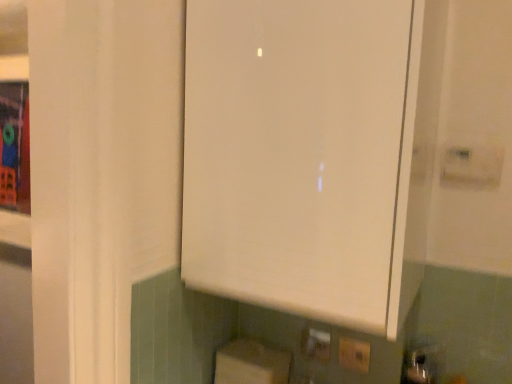
Locate an element on the screen. white cardboard box at lower center is located at coordinates (251, 363).

How much space does white plastic electric outlet at lower center, which is counted as the 1th electric outlet, starting from the right, occupy horizontally?

The width of white plastic electric outlet at lower center, which is counted as the 1th electric outlet, starting from the right, is 0.60 inches.

I want to click on white matte cabinet at center, so click(x=303, y=156).

At what (x,y) coordinates should I click in order to perform the action: click on white cardboard box at lower center. Please return your answer as a coordinate pair (x, y). Looking at the image, I should click on (251, 363).

From the picture: What's the angular difference between yellow plastic electric outlet at lower center, which is the 2th electric outlet from right to left, and white plastic electric outlet at lower center, which appears as the 2th electric outlet when viewed from the back,'s facing directions?

3.33 degrees.

Is yellow plastic electric outlet at lower center, which appears as the first electric outlet when viewed from the back, to the left of white plastic electric outlet at lower center, which is the 2th electric outlet in left-to-right order, from the viewer's perspective?

Indeed, yellow plastic electric outlet at lower center, which appears as the first electric outlet when viewed from the back, is positioned on the left side of white plastic electric outlet at lower center, which is the 2th electric outlet in left-to-right order.

Would you consider yellow plastic electric outlet at lower center, placed as the first electric outlet when sorted from left to right, to be distant from white plastic electric outlet at lower center, which is the 2th electric outlet in left-to-right order?

yellow plastic electric outlet at lower center, placed as the first electric outlet when sorted from left to right, is actually quite close to white plastic electric outlet at lower center, which is the 2th electric outlet in left-to-right order.

From a real-world perspective, is yellow plastic electric outlet at lower center, which appears as the first electric outlet when viewed from the back, beneath white plastic electric outlet at lower center, marked as the 1th electric outlet in a front-to-back arrangement?

Yes.

Considering the points (407, 232) and (273, 354), which point is behind, point (407, 232) or point (273, 354)?

Positioned behind is point (273, 354).

Identify the location of cabinetry in front of the white cardboard box at lower center. (303, 156).

How different are the orientations of white matte cabinet at center and white cardboard box at lower center in degrees?

There is a 1.71-degree angle between the facing directions of white matte cabinet at center and white cardboard box at lower center.

From the image's perspective, which is below, white matte cabinet at center or white cardboard box at lower center?

white cardboard box at lower center is shown below in the image.

From a real-world perspective, is white matte cabinet at center beneath white plastic electric outlet at lower center, which is the 2th electric outlet in left-to-right order?

Actually, white matte cabinet at center is physically above white plastic electric outlet at lower center, which is the 2th electric outlet in left-to-right order, in the real world.

Between white matte cabinet at center and white plastic electric outlet at lower center, which is the 2th electric outlet in left-to-right order, which one has larger width?

With larger width is white matte cabinet at center.

In the scene shown: Which point is more distant from viewer, (369, 116) or (367, 370)?

The point (367, 370) is behind.

Is white matte cabinet at center to the left or to the right of white plastic electric outlet at lower center, which is counted as the 1th electric outlet, starting from the right, in the image?

white matte cabinet at center is positioned on white plastic electric outlet at lower center, which is counted as the 1th electric outlet, starting from the right,'s left side.

Is white matte cabinet at center thinner than yellow plastic electric outlet at lower center, placed as the second electric outlet when sorted from front to back?

No.

Is the depth of white matte cabinet at center less than that of yellow plastic electric outlet at lower center, which is the 2th electric outlet from right to left?

Yes, it is in front of yellow plastic electric outlet at lower center, which is the 2th electric outlet from right to left.

Considering the sizes of objects white matte cabinet at center and yellow plastic electric outlet at lower center, which is the 2th electric outlet from right to left, in the image provided, who is shorter, white matte cabinet at center or yellow plastic electric outlet at lower center, which is the 2th electric outlet from right to left,?

yellow plastic electric outlet at lower center, which is the 2th electric outlet from right to left.

What's the angular difference between white cardboard box at lower center and white plastic electric outlet at lower center, which is the 2th electric outlet in left-to-right order,'s facing directions?

The angle between the facing direction of white cardboard box at lower center and the facing direction of white plastic electric outlet at lower center, which is the 2th electric outlet in left-to-right order, is 0.352 degrees.

Who is taller, white cardboard box at lower center or white plastic electric outlet at lower center, which is counted as the 1th electric outlet, starting from the right?

With more height is white cardboard box at lower center.

Are white cardboard box at lower center and white plastic electric outlet at lower center, which appears as the 2th electric outlet when viewed from the back, beside each other?

No, white cardboard box at lower center is not making contact with white plastic electric outlet at lower center, which appears as the 2th electric outlet when viewed from the back.

How much distance is there between white cardboard box at lower center and white plastic electric outlet at lower center, marked as the 1th electric outlet in a front-to-back arrangement?

white cardboard box at lower center is 9.51 inches from white plastic electric outlet at lower center, marked as the 1th electric outlet in a front-to-back arrangement.

Based on the photo, from the image's perspective, who appears lower, yellow plastic electric outlet at lower center, placed as the second electric outlet when sorted from front to back, or white cardboard box at lower center?

white cardboard box at lower center, from the image's perspective.

From a real-world perspective, does yellow plastic electric outlet at lower center, placed as the second electric outlet when sorted from front to back, stand above white cardboard box at lower center?

Yes, from a real-world perspective, yellow plastic electric outlet at lower center, placed as the second electric outlet when sorted from front to back, is over white cardboard box at lower center

This screenshot has height=384, width=512. Identify the location of cardboard box that appears below the yellow plastic electric outlet at lower center, placed as the second electric outlet when sorted from front to back (from the image's perspective). (251, 363).

Is yellow plastic electric outlet at lower center, which appears as the first electric outlet when viewed from the back, looking in the opposite direction of white cardboard box at lower center?

That's not correct — yellow plastic electric outlet at lower center, which appears as the first electric outlet when viewed from the back, is not looking away from white cardboard box at lower center.

Is yellow plastic electric outlet at lower center, which appears as the first electric outlet when viewed from the back, not within white matte cabinet at center?

That's correct, yellow plastic electric outlet at lower center, which appears as the first electric outlet when viewed from the back, is outside of white matte cabinet at center.

This screenshot has height=384, width=512. In order to click on cabinetry in front of the yellow plastic electric outlet at lower center, placed as the second electric outlet when sorted from front to back in this screenshot , I will do `click(303, 156)`.

Is yellow plastic electric outlet at lower center, which appears as the first electric outlet when viewed from the back, touching white matte cabinet at center?

No, yellow plastic electric outlet at lower center, which appears as the first electric outlet when viewed from the back, is not beside white matte cabinet at center.

Could you tell me if yellow plastic electric outlet at lower center, which is the 2th electric outlet from right to left, is turned towards white matte cabinet at center?

No, yellow plastic electric outlet at lower center, which is the 2th electric outlet from right to left, is not turned towards white matte cabinet at center.

Identify the location of electric outlet above the yellow plastic electric outlet at lower center, which appears as the first electric outlet when viewed from the back (from a real-world perspective). tap(354, 354).

Where is `cabinetry on the right of white cardboard box at lower center`? cabinetry on the right of white cardboard box at lower center is located at coordinates (303, 156).

Estimate the real-world distances between objects in this image. Which object is closer to white matte cabinet at center, yellow plastic electric outlet at lower center, which is the 2th electric outlet from right to left, or white plastic electric outlet at lower center, which is the 2th electric outlet in left-to-right order?

yellow plastic electric outlet at lower center, which is the 2th electric outlet from right to left, lies closer to white matte cabinet at center than the other object.

Considering their positions, is white matte cabinet at center positioned closer to white cardboard box at lower center than yellow plastic electric outlet at lower center, placed as the first electric outlet when sorted from left to right?

yellow plastic electric outlet at lower center, placed as the first electric outlet when sorted from left to right, lies closer to white cardboard box at lower center than the other object.

Looking at this image, considering their positions, is yellow plastic electric outlet at lower center, which appears as the first electric outlet when viewed from the back, positioned further to white plastic electric outlet at lower center, which is the 2th electric outlet in left-to-right order, than white cardboard box at lower center?

white cardboard box at lower center is further to white plastic electric outlet at lower center, which is the 2th electric outlet in left-to-right order.

Looking at the image, which one is located closer to white cardboard box at lower center, yellow plastic electric outlet at lower center, which is the 2th electric outlet from right to left, or white matte cabinet at center?

yellow plastic electric outlet at lower center, which is the 2th electric outlet from right to left, is closer to white cardboard box at lower center.

Considering their positions, is white cardboard box at lower center positioned further to white plastic electric outlet at lower center, which appears as the 2th electric outlet when viewed from the back, than yellow plastic electric outlet at lower center, placed as the second electric outlet when sorted from front to back?

white cardboard box at lower center lies further to white plastic electric outlet at lower center, which appears as the 2th electric outlet when viewed from the back, than the other object.

Which object lies nearer to the anchor point white matte cabinet at center, white plastic electric outlet at lower center, which is counted as the 1th electric outlet, starting from the right, or white cardboard box at lower center?

white cardboard box at lower center is closer to white matte cabinet at center.

Based on their spatial positions, is white matte cabinet at center or white plastic electric outlet at lower center, which is the 2th electric outlet in left-to-right order, closer to yellow plastic electric outlet at lower center, placed as the second electric outlet when sorted from front to back?

Based on the image, white plastic electric outlet at lower center, which is the 2th electric outlet in left-to-right order, appears to be nearer to yellow plastic electric outlet at lower center, placed as the second electric outlet when sorted from front to back.

Consider the image. When comparing their distances from white plastic electric outlet at lower center, which is counted as the 1th electric outlet, starting from the right, does yellow plastic electric outlet at lower center, placed as the second electric outlet when sorted from front to back, or white matte cabinet at center seem closer?

Based on the image, yellow plastic electric outlet at lower center, placed as the second electric outlet when sorted from front to back, appears to be nearer to white plastic electric outlet at lower center, which is counted as the 1th electric outlet, starting from the right.

The width and height of the screenshot is (512, 384). I want to click on electric outlet between white matte cabinet at center and white plastic electric outlet at lower center, which appears as the 2th electric outlet when viewed from the back, in the up-down direction, so 316,344.

This screenshot has width=512, height=384. Identify the location of electric outlet situated between white cardboard box at lower center and white plastic electric outlet at lower center, which is counted as the 1th electric outlet, starting from the right, from left to right. (316, 344).